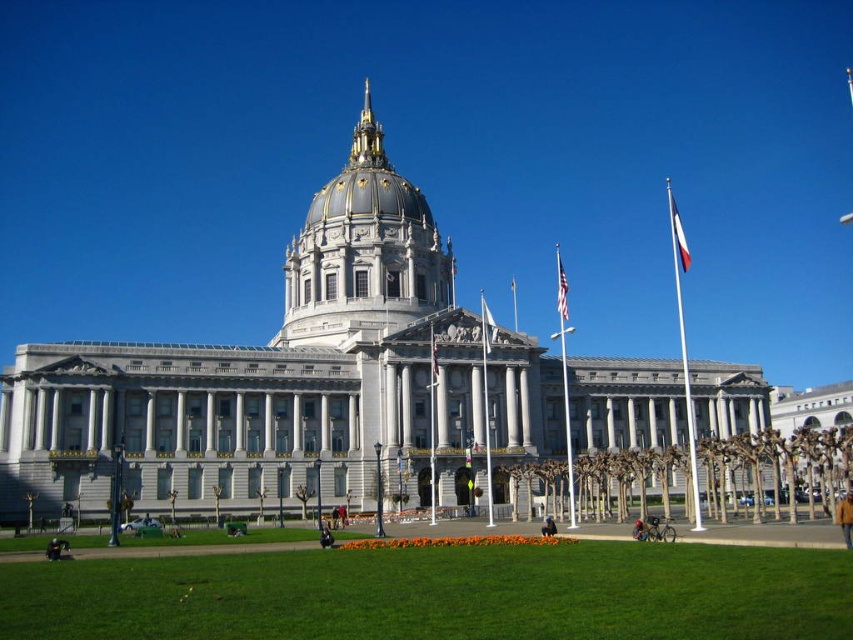
Is brown leather jacket at lower right above white fabric flag at center?

Incorrect, brown leather jacket at lower right is not positioned above white fabric flag at center.

Is brown leather jacket at lower right closer to camera compared to white fabric flag at center?

That is True.

You are a GUI agent. You are given a task and a screenshot of the screen. Output one action in this format:
    pyautogui.click(x=<x>, y=<y>)
    Task: Click on the brown leather jacket at lower right
    This screenshot has height=640, width=853.
    Given the screenshot: What is the action you would take?
    pyautogui.click(x=845, y=516)

Is green grass at lower center shorter than denim jacket at lower right?

No.

Between green grass at lower center and denim jacket at lower right, which one appears on the right side from the viewer's perspective?

→ denim jacket at lower right is more to the right.

I want to click on green grass at lower center, so click(439, 595).

Between gold/gilded dome at center and white fabric flag at right, which one is positioned lower?

Positioned lower is gold/gilded dome at center.

Does gold/gilded dome at center appear on the left side of white fabric flag at right?

Indeed, gold/gilded dome at center is positioned on the left side of white fabric flag at right.

Who is more forward, (437, 228) or (676, 227)?

Point (437, 228) is in front.

Where is `gold/gilded dome at center`? gold/gilded dome at center is located at coordinates (363, 252).